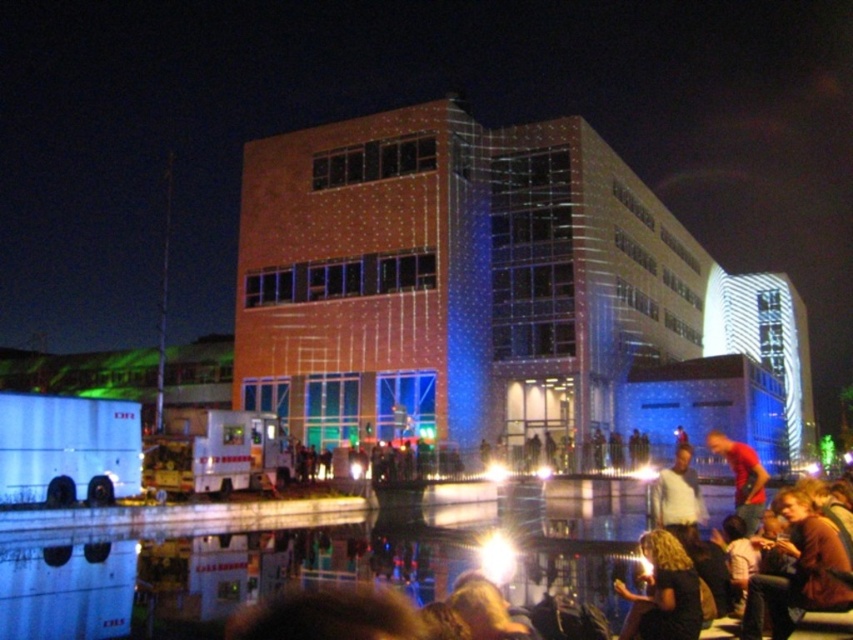
Question: Does white shirt at center come in front of matte red shirt at lower right?

Choices:
 (A) no
 (B) yes

Answer: (B)

Question: Which object appears closest to the camera in this image?

Choices:
 (A) dark hair at lower right
 (B) white shirt at center

Answer: (A)

Question: Estimate the real-world distances between objects in this image. Which object is closer to the dark hair at lower right?

Choices:
 (A) white shirt at center
 (B) matte red shirt at lower right

Answer: (A)

Question: In this image, where is white shirt at center located relative to matte red shirt at lower right?

Choices:
 (A) right
 (B) left

Answer: (B)

Question: Which object appears farthest from the camera in this image?

Choices:
 (A) matte red shirt at lower right
 (B) dark hair at lower right

Answer: (A)

Question: Is dark hair at lower right bigger than white shirt at center?

Choices:
 (A) yes
 (B) no

Answer: (B)